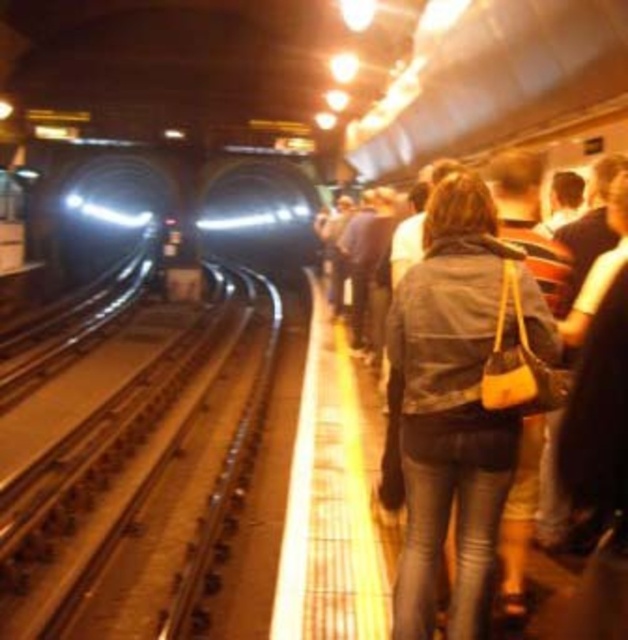
Who is more distant from viewer, [242,460] or [406,600]?

Point [242,460]

Who is higher up, metallic smooth train track at center or leather jacket at center?

leather jacket at center is above.

You are a GUI agent. You are given a task and a screenshot of the screen. Output one action in this format:
    pyautogui.click(x=<x>, y=<y>)
    Task: Click on the metallic smooth train track at center
    
    Given the screenshot: What is the action you would take?
    pyautogui.click(x=143, y=483)